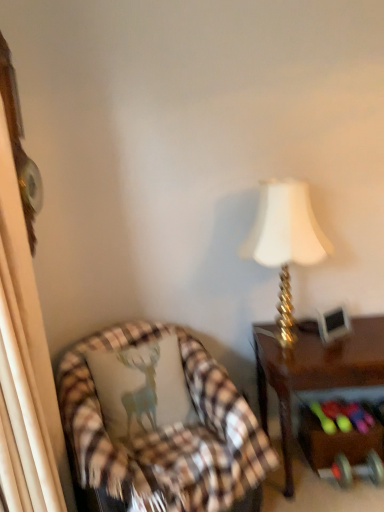
Question: Does brown wooden desk at right have a lesser width compared to plaid fabric pillow at left?

Choices:
 (A) no
 (B) yes

Answer: (A)

Question: Could you tell me if brown wooden desk at right is turned towards plaid fabric pillow at left?

Choices:
 (A) no
 (B) yes

Answer: (A)

Question: Is brown wooden desk at right shorter than plaid fabric pillow at left?

Choices:
 (A) yes
 (B) no

Answer: (B)

Question: Is brown wooden desk at right closer to the viewer compared to plaid fabric pillow at left?

Choices:
 (A) no
 (B) yes

Answer: (A)

Question: Can you confirm if brown wooden desk at right is positioned to the left of plaid fabric pillow at left?

Choices:
 (A) no
 (B) yes

Answer: (A)

Question: Is point (319, 454) positioned closer to the camera than point (147, 385)?

Choices:
 (A) closer
 (B) farther

Answer: (B)

Question: Which is correct: metallic silver dumbbell at lower right is inside plaid fabric pillow at left, or outside of it?

Choices:
 (A) inside
 (B) outside

Answer: (B)

Question: Looking at their shapes, would you say metallic silver dumbbell at lower right is wider or thinner than plaid fabric pillow at left?

Choices:
 (A) wide
 (B) thin

Answer: (B)

Question: From the image's perspective, relative to plaid fabric pillow at left, is metallic silver dumbbell at lower right above or below?

Choices:
 (A) below
 (B) above

Answer: (A)

Question: From the image's perspective, is brown wooden desk at right positioned above or below plaid fabric pillow at left?

Choices:
 (A) below
 (B) above

Answer: (A)

Question: In terms of height, does brown wooden desk at right look taller or shorter compared to plaid fabric pillow at left?

Choices:
 (A) tall
 (B) short

Answer: (A)

Question: From a real-world perspective, is brown wooden desk at right physically located above or below plaid fabric pillow at left?

Choices:
 (A) above
 (B) below

Answer: (B)

Question: Considering their positions, is brown wooden desk at right located in front of or behind plaid fabric pillow at left?

Choices:
 (A) front
 (B) behind

Answer: (B)

Question: Does point (140, 415) appear closer or farther from the camera than point (269, 181)?

Choices:
 (A) closer
 (B) farther

Answer: (A)

Question: From their relative heights in the image, would you say plaid fabric pillow at left is taller or shorter than gold metallic lamp at upper right?

Choices:
 (A) short
 (B) tall

Answer: (A)